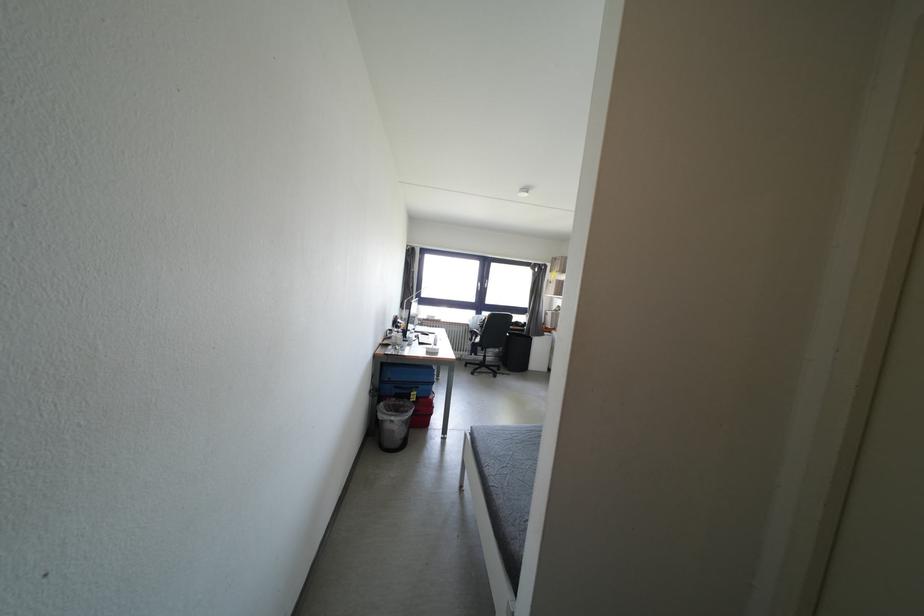
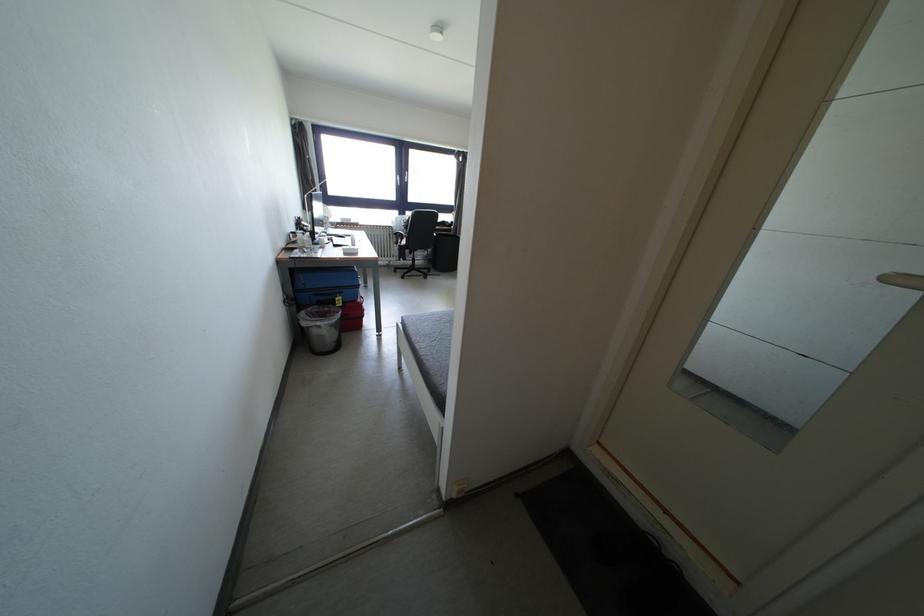
Where in the second image is the point corresponding to point 398,423 from the first image?

(324, 328)